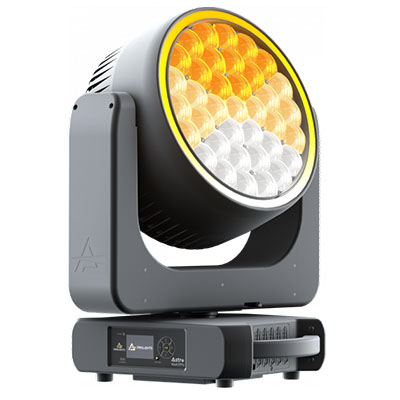
Identify the location of heater. (221, 210).